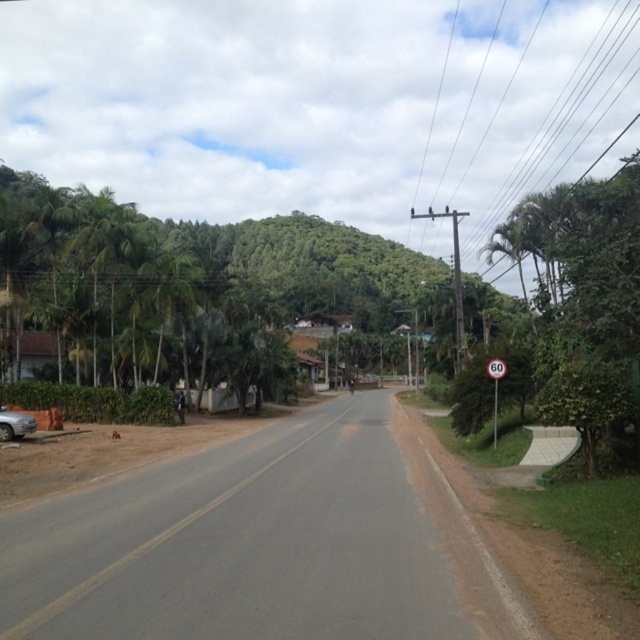
You are driving on this rural road and see the green leafy trees at left and the white plastic speed limit sign at right. Which object is closer to the driver side of the car?

The green leafy trees at left are closer to the driver side of the car because they are positioned on the left side of the white plastic speed limit sign at right, which is on the right side of the road. Since the driver side is typically on the left side of the car, the trees are closer.